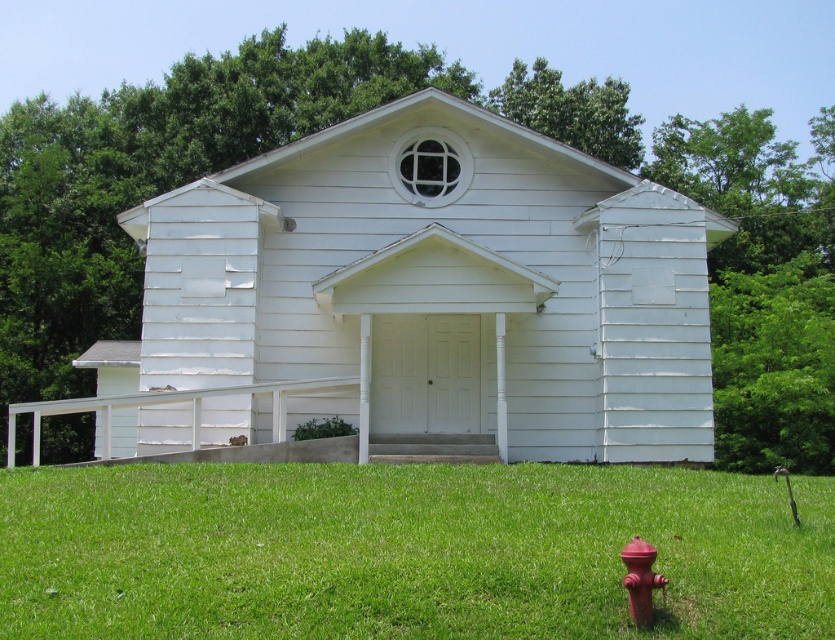
Which is above, white wood church at center or red matte fire hydrant at lower right?

white wood church at center is higher up.

Who is shorter, white wood church at center or red matte fire hydrant at lower right?

red matte fire hydrant at lower right is shorter.

Measure the distance between white wood church at center and camera.

white wood church at center is 12.74 meters away from camera.

Where is `white wood church at center`? This screenshot has height=640, width=835. white wood church at center is located at coordinates (421, 292).

How far apart are white wood church at center and green grass at lower center?

white wood church at center and green grass at lower center are 4.08 meters apart.

Does white wood church at center have a greater width compared to green grass at lower center?

Indeed, white wood church at center has a greater width compared to green grass at lower center.

Does point (544, 260) come behind point (300, 550)?

Yes.

Identify the location of white wood church at center. (421, 292).

Can you confirm if green grass at lower center is taller than red matte fire hydrant at lower right?

Correct, green grass at lower center is much taller as red matte fire hydrant at lower right.

Based on the photo, measure the distance between green grass at lower center and camera.

green grass at lower center and camera are 5.31 meters apart from each other.

Does point (157, 554) come closer to viewer compared to point (641, 548)?

No, it is not.

Where is `green grass at lower center`? The width and height of the screenshot is (835, 640). green grass at lower center is located at coordinates (407, 552).